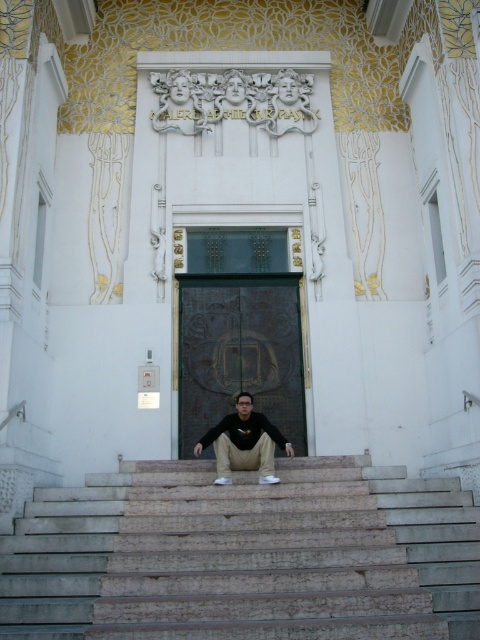
Based on the photo, you are standing at the entrance of the building and want to go up the marble stairs at center. Which direction should you walk to reach the point marked by the coordinates point (243, 556)?

The point marked by the coordinates point (243, 556) is on the marble stairs at center, so you should walk towards the center of the marble stairs to reach it.

You are standing at the entrance of the building and need to go up the stairs. Which object, the marble stairs at center or the black matte shirt at center, is bigger in size and thus more likely to be the path you should take?

The marble stairs at center has a larger size compared to the black matte shirt at center, so you should take the marble stairs at center as the path.